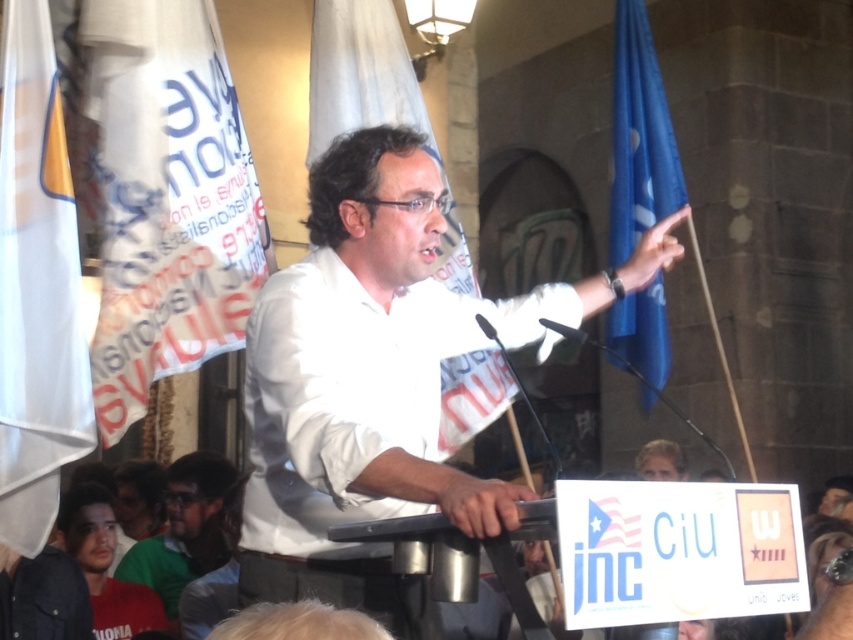
Question: Does white matte shirt at center have a smaller size compared to white fabric flag at upper left?

Choices:
 (A) no
 (B) yes

Answer: (B)

Question: Which is nearer to the white fabric banner at upper left?

Choices:
 (A) white fabric flag at center
 (B) white fabric flag at upper left
 (C) blue fabric flag at right

Answer: (B)

Question: Observing the image, what is the correct spatial positioning of white matte shirt at center in reference to white fabric flag at center?

Choices:
 (A) left
 (B) right

Answer: (B)

Question: Is white fabric flag at upper left to the right of blue fabric flag at right from the viewer's perspective?

Choices:
 (A) yes
 (B) no

Answer: (B)

Question: Which object is positioned closest to the white fabric banner at upper left?

Choices:
 (A) white fabric flag at center
 (B) green matte shirt at lower left
 (C) white fabric flag at upper left
 (D) blue fabric flag at right

Answer: (C)

Question: Which of the following is the closest to the observer?

Choices:
 (A) (158, 161)
 (B) (387, 275)

Answer: (B)